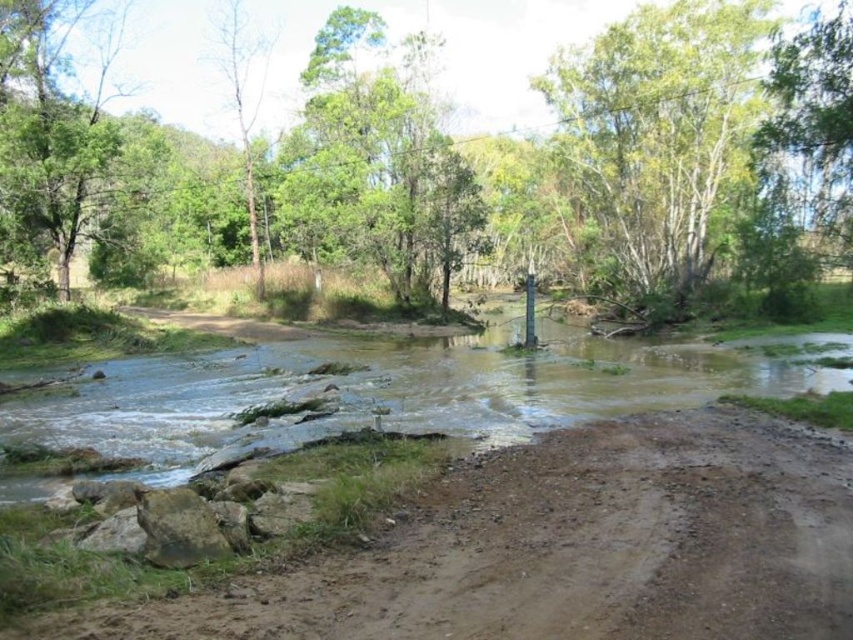
You are hiking along the brown dirt track at lower left and want to cross the brown muddy stream at center. Which direction should you walk to reach the stream first?

The brown dirt track at lower left is in front of brown muddy stream at center, so you should walk forward along the brown dirt track at lower left to reach the stream first.

You are planning to take a walk along the dirt path next to the river. Considering the green leafy tree at center and the green leafy tree at upper center, which one would you need to look up higher to see?

The green leafy tree at center has a greater height compared to the green leafy tree at upper center, so you would need to look up higher to see the green leafy tree at center.